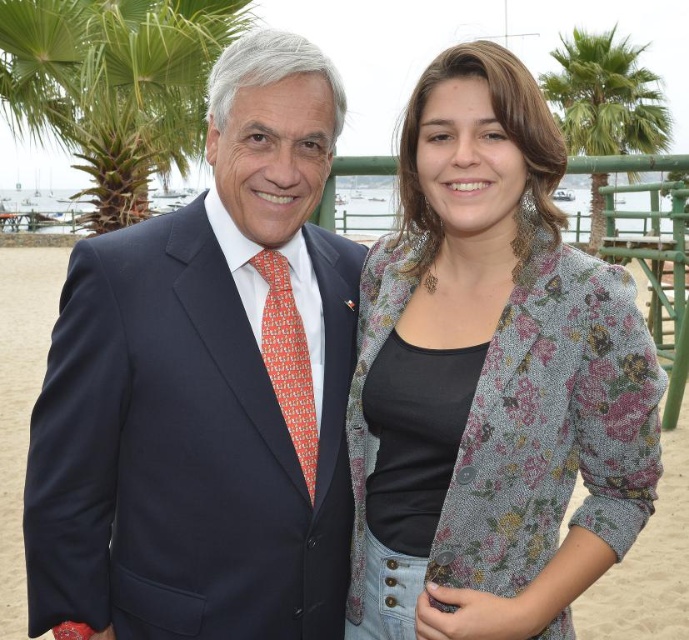
Question: Among these points, which one is farthest from the camera?

Choices:
 (A) (305, 467)
 (B) (573, 148)
 (C) (387, 444)
 (D) (169, 29)

Answer: (B)

Question: From the image, what is the correct spatial relationship of green leafy palm tree at upper right in relation to orange printed tie at center?

Choices:
 (A) above
 (B) below

Answer: (A)

Question: From the image, what is the correct spatial relationship of navy blue suit at center in relation to floral-patterned jacket at center?

Choices:
 (A) above
 (B) below

Answer: (A)

Question: Which point is farther to the camera?

Choices:
 (A) (125, 214)
 (B) (658, 138)
 (C) (579, 456)
 (D) (291, 400)

Answer: (B)

Question: Among these points, which one is nearest to the camera?

Choices:
 (A) (424, 257)
 (B) (296, 442)

Answer: (B)

Question: Is floral-patterned jacket at center closer to the viewer compared to orange printed tie at center?

Choices:
 (A) yes
 (B) no

Answer: (A)